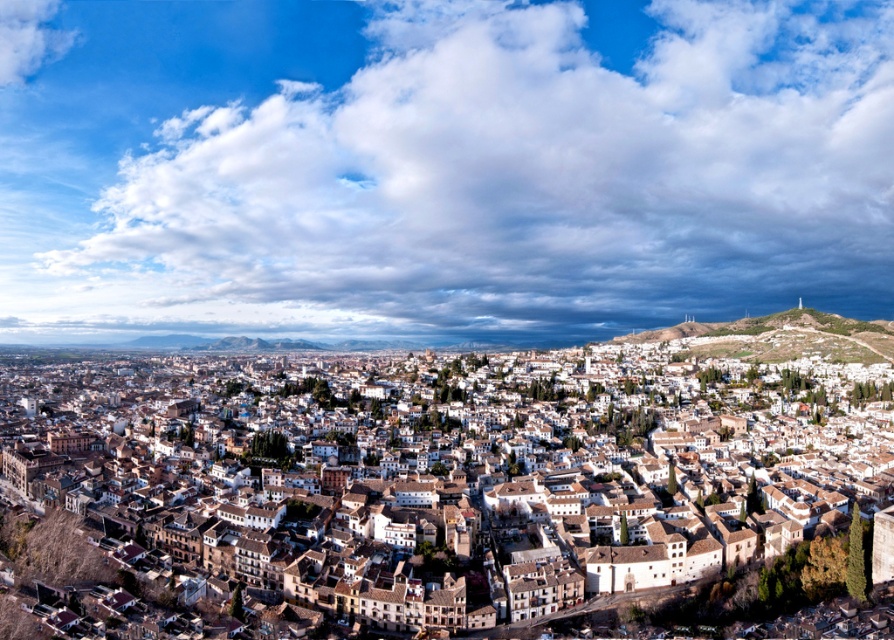
Question: Considering the relative positions of cloudy sky at upper center and white textured buildings at center in the image provided, where is cloudy sky at upper center located with respect to white textured buildings at center?

Choices:
 (A) left
 (B) right

Answer: (B)

Question: Which point appears farthest from the camera in this image?

Choices:
 (A) (13, 52)
 (B) (682, 396)
 (C) (562, 20)

Answer: (A)

Question: Is cloudy sky at upper center to the right of white textured buildings at center from the viewer's perspective?

Choices:
 (A) yes
 (B) no

Answer: (A)

Question: Which of the following is the closest to the observer?

Choices:
 (A) (0, 61)
 (B) (646, 365)

Answer: (B)

Question: Is cloudy sky at upper center to the right of white fluffy cloud at upper left from the viewer's perspective?

Choices:
 (A) yes
 (B) no

Answer: (A)

Question: Which point is closer to the camera?

Choices:
 (A) cloudy sky at upper center
 (B) white fluffy cloud at upper left
 (C) white textured buildings at center

Answer: (C)